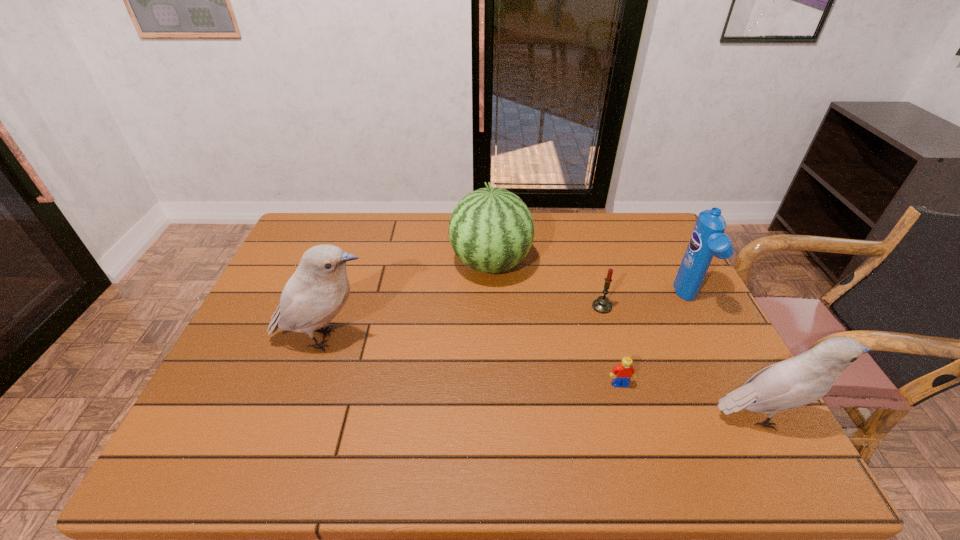
Locate an element on the screen. The width and height of the screenshot is (960, 540). the leftmost object is located at coordinates (313, 296).

Where is `the farther bird`? The height and width of the screenshot is (540, 960). the farther bird is located at coordinates (313, 296).

Find the location of `the shorter bird`. the shorter bird is located at coordinates (800, 380).

You are a GUI agent. You are given a task and a screenshot of the screen. Output one action in this format:
    pyautogui.click(x=<x>, y=<y>)
    Task: Click on the nearest object
    The height and width of the screenshot is (540, 960).
    Given the screenshot: What is the action you would take?
    pyautogui.click(x=800, y=380)

Identify the location of the fifth tallest object. This screenshot has width=960, height=540. (602, 304).

This screenshot has width=960, height=540. In order to click on watermelon in this screenshot , I will do `click(491, 230)`.

Find the location of a particular element. shampoo is located at coordinates (707, 240).

Find the location of a particular element. The height and width of the screenshot is (540, 960). the second nearest object is located at coordinates (622, 373).

The image size is (960, 540). Find the location of `the shortest object`. the shortest object is located at coordinates (622, 373).

The height and width of the screenshot is (540, 960). Identify the location of vacant region located at the beak of the left bird. (533, 340).